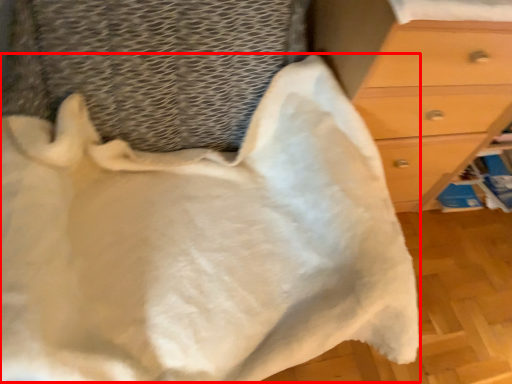
Question: In this image, where is blanket (annotated by the red box) located relative to chest of drawers?

Choices:
 (A) right
 (B) left

Answer: (B)